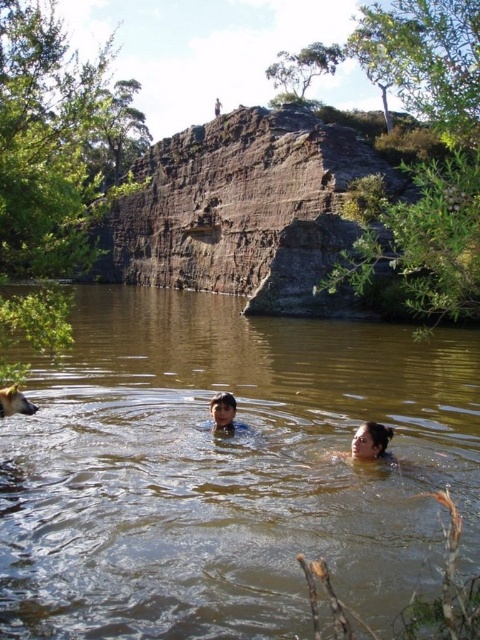
Question: Does brown murky water at center have a smaller size compared to golden fur dog at lower left?

Choices:
 (A) no
 (B) yes

Answer: (A)

Question: Does brown murky water at center appear on the left side of smooth skin face at lower center?

Choices:
 (A) yes
 (B) no

Answer: (A)

Question: Which is farther from the golden fur dog at lower left?

Choices:
 (A) smooth skin face at lower center
 (B) smooth skin face at center
 (C) brown murky water at center

Answer: (A)

Question: Is brown murky water at center below golden fur dog at lower left?

Choices:
 (A) yes
 (B) no

Answer: (A)

Question: Among these objects, which one is farthest from the camera?

Choices:
 (A) smooth skin face at lower center
 (B) brown murky water at center
 (C) golden fur dog at lower left
 (D) smooth skin face at center

Answer: (D)

Question: Which of the following is the farthest from the observer?

Choices:
 (A) smooth skin face at center
 (B) golden fur dog at lower left
 (C) brown murky water at center
 (D) smooth skin face at lower center

Answer: (A)